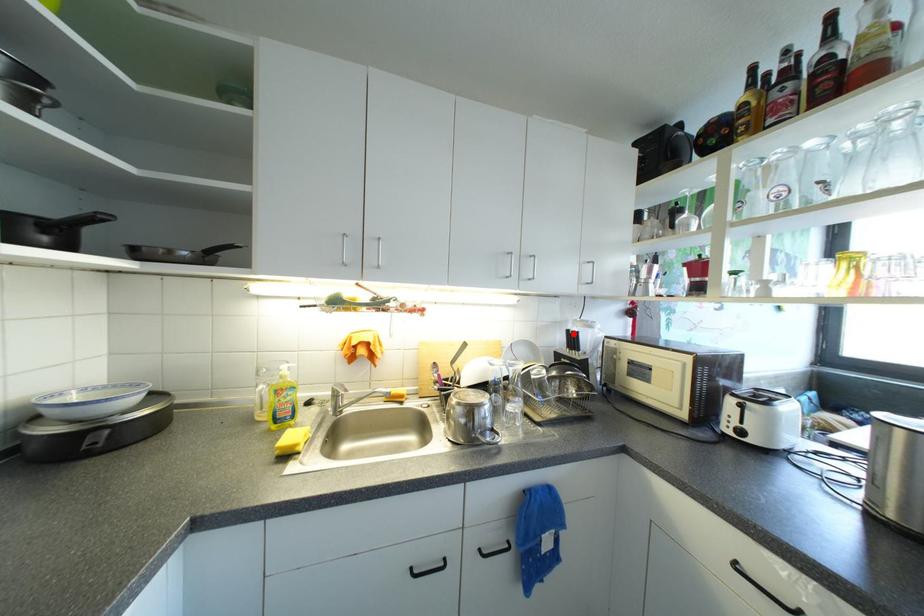
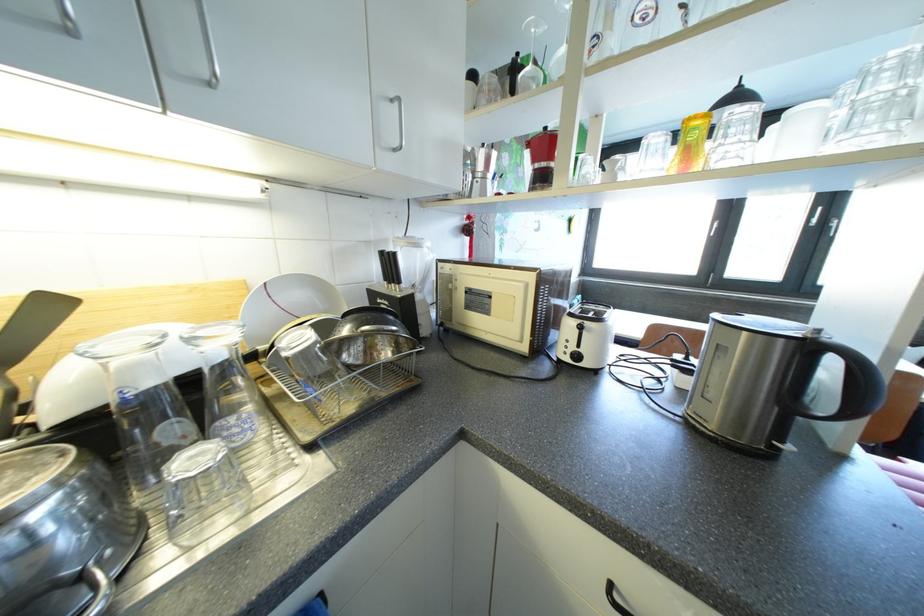
In the second image, find the point that corresponds to the highlighted location in the first image.

(387, 256)